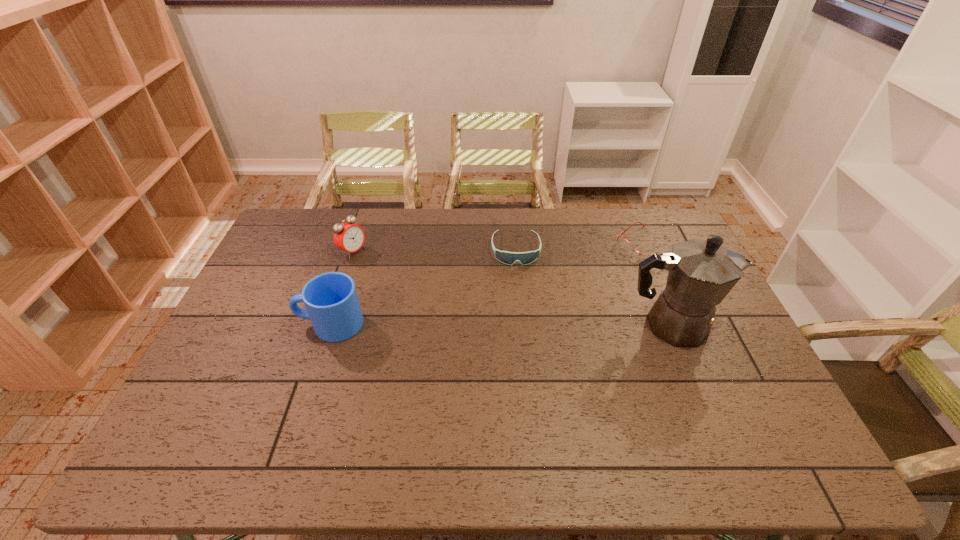
Find the location of a particular element. alarm clock present at the far edge is located at coordinates (349, 237).

Identify the location of coffeepot present at the right edge. The width and height of the screenshot is (960, 540). (701, 273).

Find the location of a particular element. The width and height of the screenshot is (960, 540). spectacles that is at the right edge is located at coordinates (624, 244).

Image resolution: width=960 pixels, height=540 pixels. Identify the location of object at the far right corner. (624, 244).

In the image, there is a desktop. Where is `vacant space at the far edge`? This screenshot has width=960, height=540. vacant space at the far edge is located at coordinates (630, 225).

At what (x,y) coordinates should I click in order to perform the action: click on free space at the near edge. Please return your answer as a coordinate pair (x, y). This screenshot has height=540, width=960. Looking at the image, I should click on (479, 420).

You are a GUI agent. You are given a task and a screenshot of the screen. Output one action in this format:
    pyautogui.click(x=<x>, y=<y>)
    Task: Click on the vacant area at the left edge of the desktop
    This screenshot has height=540, width=960.
    Given the screenshot: What is the action you would take?
    pyautogui.click(x=272, y=302)

At what (x,y) coordinates should I click in order to perform the action: click on free spot at the far left corner of the desktop. Please return your answer as a coordinate pair (x, y). The image size is (960, 540). Looking at the image, I should click on (279, 230).

The image size is (960, 540). What are the coordinates of `free space at the far right corner of the desktop` in the screenshot? It's located at (676, 234).

Image resolution: width=960 pixels, height=540 pixels. In order to click on free region at the near right corner of the desktop in this screenshot , I will do `click(762, 422)`.